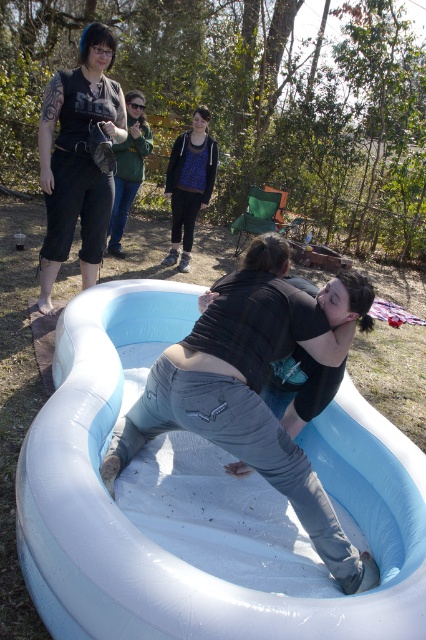
Question: Which object appears closest to the camera in this image?

Choices:
 (A) blue printed hoodie at center
 (B) white rubber pool at center

Answer: (B)

Question: Which object appears farthest from the camera in this image?

Choices:
 (A) blue printed hoodie at center
 (B) green fabric jacket at upper center

Answer: (A)

Question: Observing the image, what is the correct spatial positioning of white rubber pool at center in reference to green fabric jacket at upper center?

Choices:
 (A) right
 (B) left

Answer: (A)

Question: Which point is farther to the camera?

Choices:
 (A) (19, 529)
 (B) (207, 170)

Answer: (B)

Question: Observing the image, what is the correct spatial positioning of white rubber pool at center in reference to green fabric jacket at upper center?

Choices:
 (A) left
 (B) right

Answer: (B)

Question: Can you confirm if white rubber pool at center is positioned below green fabric jacket at upper center?

Choices:
 (A) no
 (B) yes

Answer: (B)